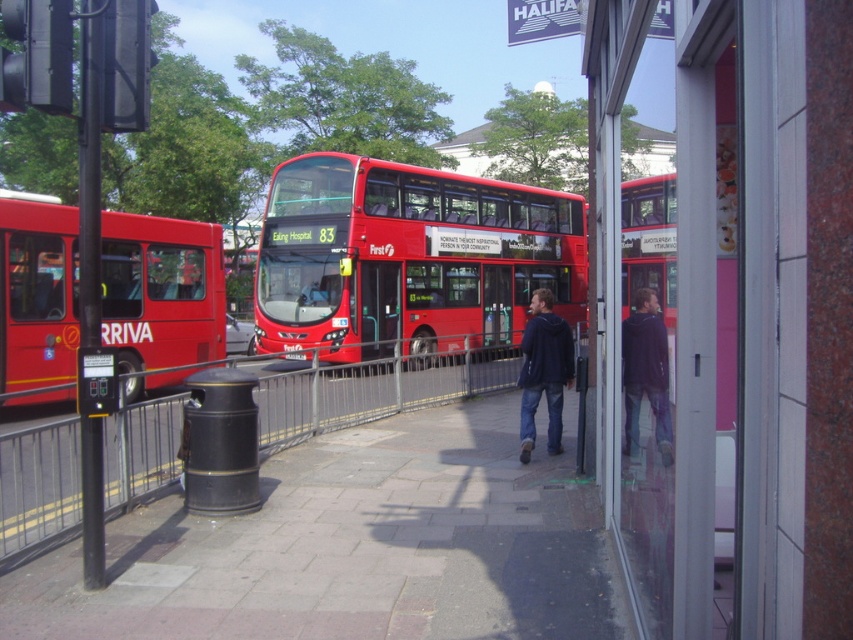
Who is lower down, dark blue jacket at center or dark blue hoodie at center?

dark blue hoodie at center

Who is more distant from viewer, (x=569, y=371) or (x=662, y=352)?

Point (x=569, y=371)

The height and width of the screenshot is (640, 853). I want to click on dark blue jacket at center, so click(543, 371).

Measure the distance between point (152, 304) and camera.

Point (152, 304) and camera are 12.92 meters apart from each other.

Which is more to the right, matte red bus at left or metallic gray fence at left?

From the viewer's perspective, metallic gray fence at left appears more on the right side.

The width and height of the screenshot is (853, 640). What do you see at coordinates (161, 291) in the screenshot? I see `matte red bus at left` at bounding box center [161, 291].

The width and height of the screenshot is (853, 640). I want to click on matte red bus at left, so click(x=161, y=291).

In the scene shown: Which is more to the left, metallic gray fence at left or dark blue hoodie at center?

metallic gray fence at left

Which of these two, metallic gray fence at left or dark blue hoodie at center, stands taller?

metallic gray fence at left

Is point (21, 541) farther from viewer compared to point (636, 396)?

Yes, it is behind point (636, 396).

Find the location of a particular element. Image resolution: width=853 pixels, height=640 pixels. metallic gray fence at left is located at coordinates (376, 388).